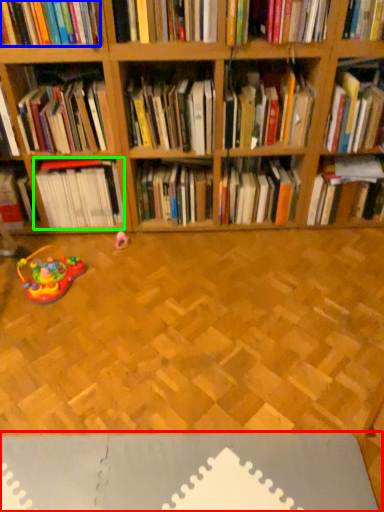
Question: Estimate the real-world distances between objects in this image. Which object is farther from surface (highlighted by a red box), book (highlighted by a blue box) or book (highlighted by a green box)?

Choices:
 (A) book
 (B) book

Answer: (A)